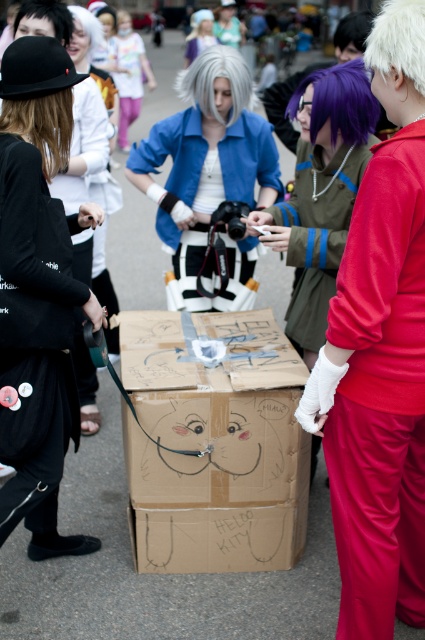
Question: Is cardboard box at center behind white matte wig at upper left?

Choices:
 (A) no
 (B) yes

Answer: (A)

Question: Is matte green jacket at center positioned before purple matte wig at upper center?

Choices:
 (A) no
 (B) yes

Answer: (A)

Question: Which point is closer to the camera?

Choices:
 (A) (319, 108)
 (B) (354, 93)
 (C) (229, 49)

Answer: (B)

Question: Which object is farther from the camera taking this photo?

Choices:
 (A) white matte wig at center
 (B) black matte hat at upper left
 (C) black matte wig at upper left

Answer: (A)

Question: Does shiny black wig at left lie in front of purple hair at center?

Choices:
 (A) no
 (B) yes

Answer: (B)

Question: Estimate the real-world distances between objects in this image. Which object is closer to the cardboard box at center?

Choices:
 (A) white fluffy wig at upper right
 (B) matte blue jacket at center
 (C) black matte wig at upper left

Answer: (B)